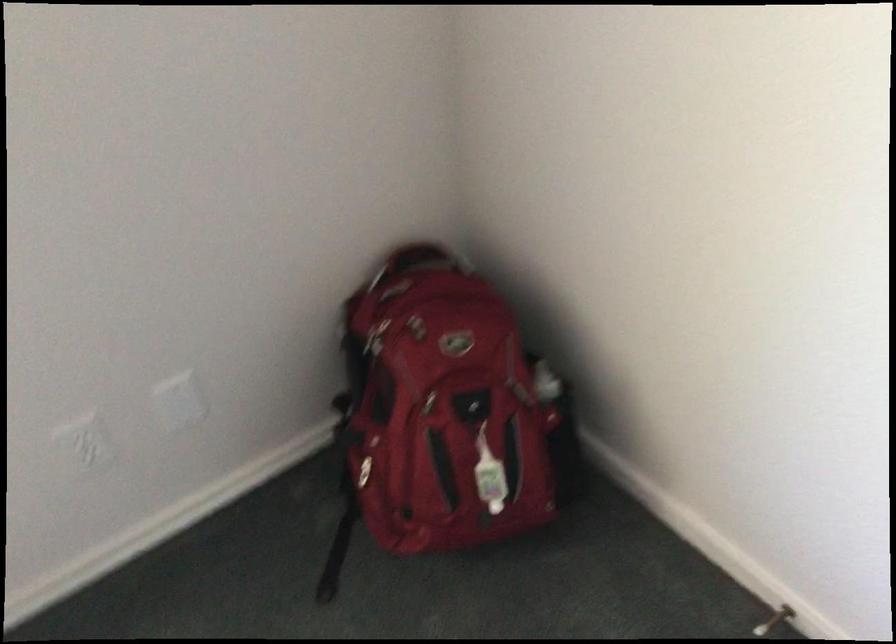
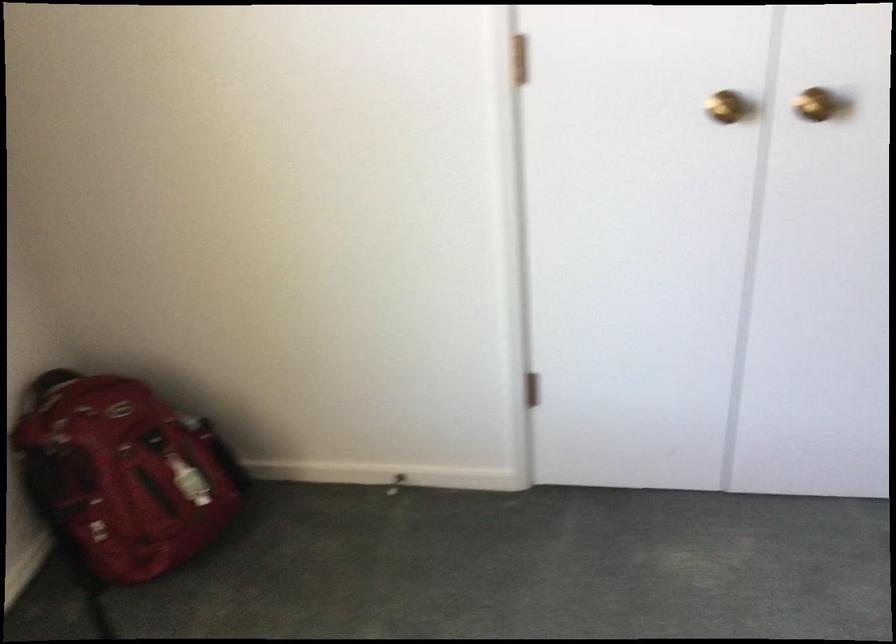
Find the pixel in the second image that matches the point at 421,418 in the first image.

(123, 474)